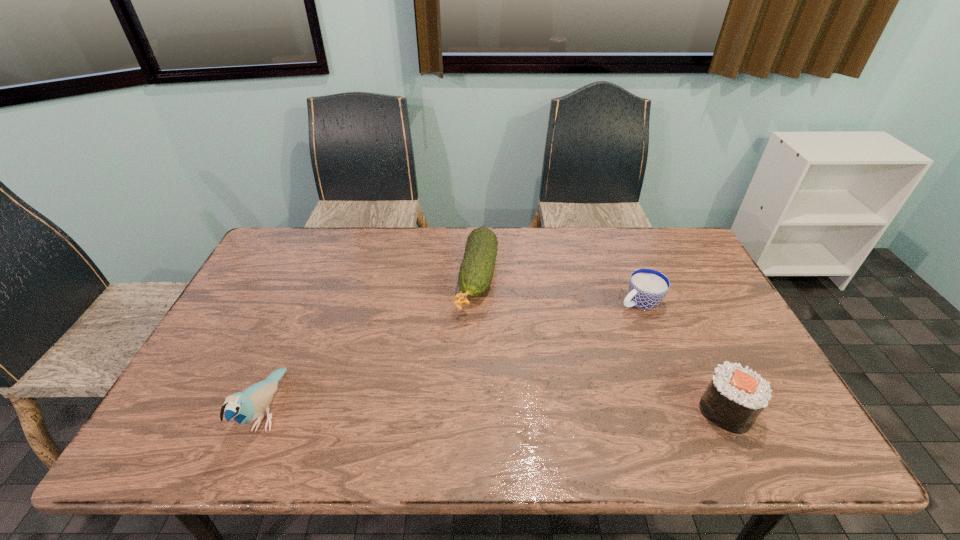
Find the location of a particular element. The image size is (960, 540). the tallest object is located at coordinates (244, 407).

Locate an element on the screen. The height and width of the screenshot is (540, 960). bird is located at coordinates point(244,407).

The width and height of the screenshot is (960, 540). What are the coordinates of `sushi` in the screenshot? It's located at (x=735, y=397).

The width and height of the screenshot is (960, 540). I want to click on the third object from right to left, so click(x=477, y=268).

This screenshot has height=540, width=960. Identify the location of the shortest object. (647, 288).

At what (x,y) coordinates should I click in order to perform the action: click on free space located 0.080m on the left of the sushi. Please return your answer as a coordinate pair (x, y). Image resolution: width=960 pixels, height=540 pixels. Looking at the image, I should click on pyautogui.click(x=665, y=410).

Find the location of a particular element. The height and width of the screenshot is (540, 960). vacant space situated at the blossom end of the cucumber is located at coordinates (466, 350).

Locate an element on the screen. free region located 0.110m at the blossom end of the cucumber is located at coordinates (466, 348).

Image resolution: width=960 pixels, height=540 pixels. In order to click on free space located 0.110m at the blossom end of the cucumber in this screenshot , I will do `click(466, 348)`.

Where is `vacant space located on the side of the shortest object with the handle`? The image size is (960, 540). vacant space located on the side of the shortest object with the handle is located at coordinates (588, 328).